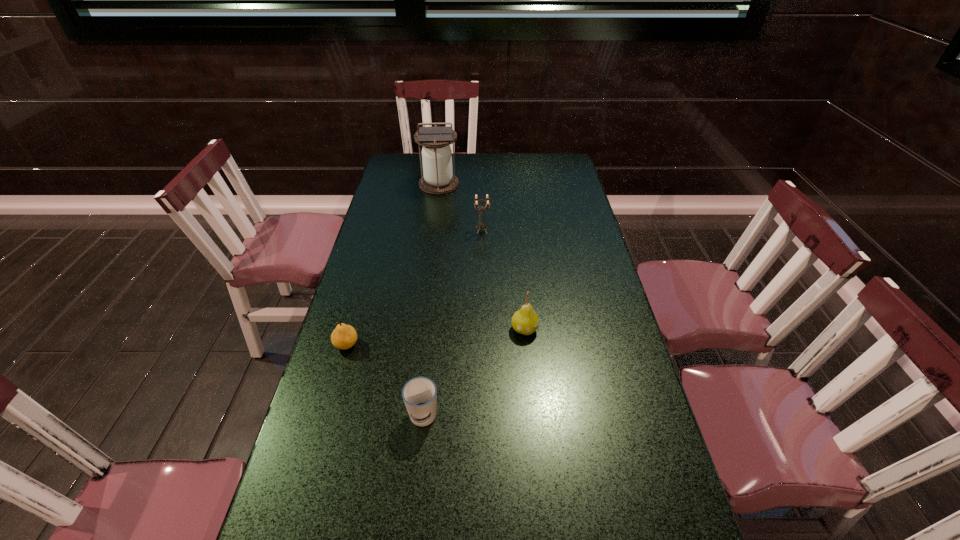
At what (x,y) coordinates should I click in order to perform the action: click on lantern. Please return your answer as a coordinate pair (x, y). The height and width of the screenshot is (540, 960). Looking at the image, I should click on (437, 178).

Identify the location of the tallest object. The height and width of the screenshot is (540, 960). (437, 178).

Where is `the fourth object from left to right`? the fourth object from left to right is located at coordinates (481, 225).

You are a GUI agent. You are given a task and a screenshot of the screen. Output one action in this format:
    pyautogui.click(x=<x>, y=<y>)
    Task: Click on the second farthest object
    This screenshot has height=540, width=960.
    Given the screenshot: What is the action you would take?
    pyautogui.click(x=481, y=225)

Where is `the rightmost object`? the rightmost object is located at coordinates (525, 321).

What are the coordinates of `the taller pear` in the screenshot? It's located at (525, 321).

I want to click on the nearest object, so click(419, 394).

In order to click on the left pear in this screenshot , I will do `click(344, 336)`.

Locate an element on the screen. This screenshot has height=540, width=960. the shorter pear is located at coordinates (344, 336).

I want to click on vacant space situated on the front of the tallest object, so click(436, 207).